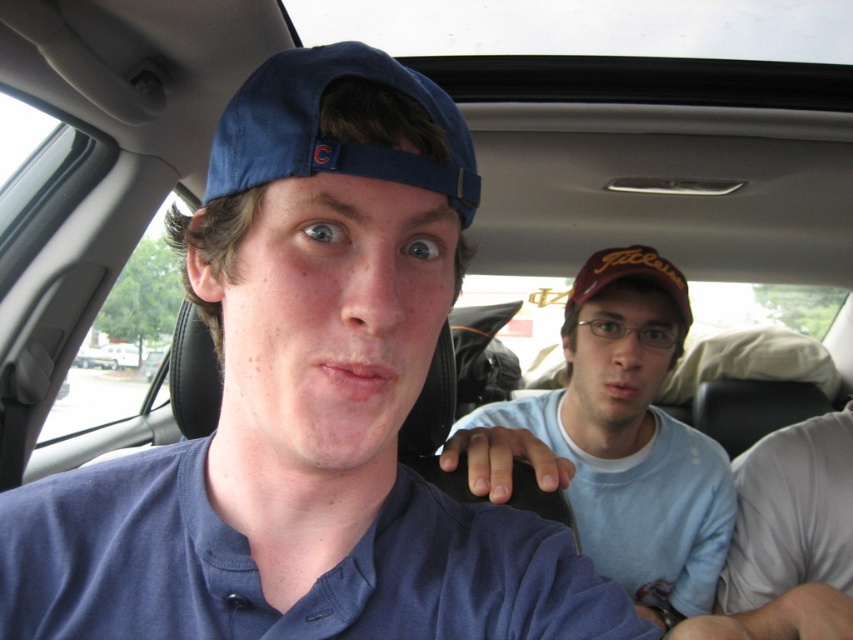
You are a passenger in the car and want to hand a snack to the person wearing the light blue cotton shirt at center. Based on their position, where should you aim to place the snack so it reaches them?

The light blue cotton shirt at center is located at coordinates point (618, 440). You should aim to place the snack near those coordinates to ensure it reaches them.

You are a passenger in the car and need to locate the light blue cotton shirt at center. According to the coordinates provided, where would you find it?

The light blue cotton shirt at center is located at the 2D coordinates point (618, 440).